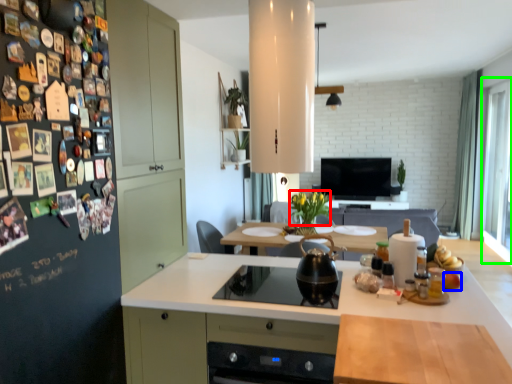
Question: Estimate the real-world distances between objects in this image. Which object is farther from flower (highlighted by a red box), food (highlighted by a blue box) or window (highlighted by a green box)?

Choices:
 (A) food
 (B) window

Answer: (B)